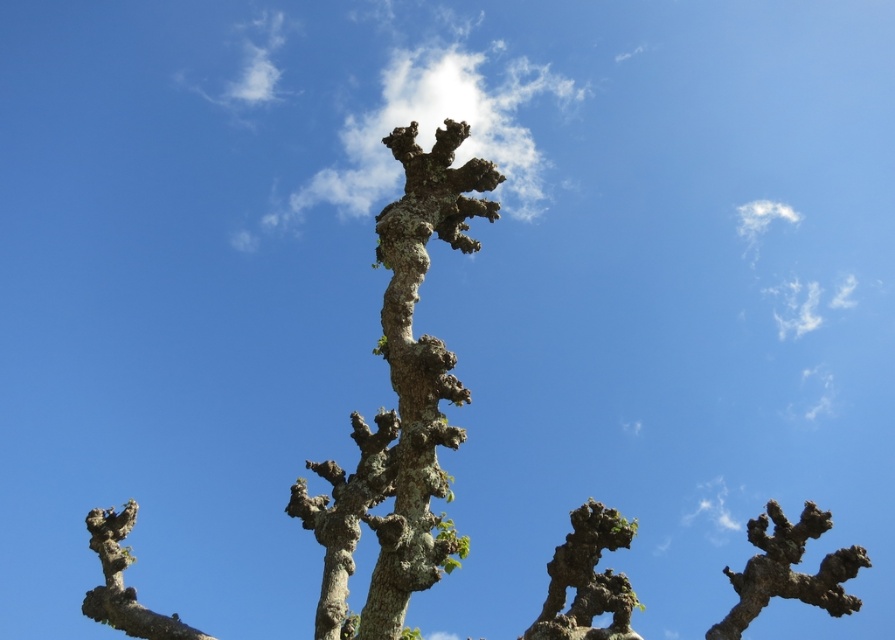
Which is above, green mossy tree trunk at center or lichen-covered bark tree at center?

green mossy tree trunk at center is above.

Which is more to the right, green mossy tree trunk at center or lichen-covered bark tree at center?

Positioned to the right is green mossy tree trunk at center.

Is point (629, 596) positioned behind point (386, 221)?

Yes, it is.

You are a GUI agent. You are given a task and a screenshot of the screen. Output one action in this format:
    pyautogui.click(x=<x>, y=<y>)
    Task: Click on the green mossy tree trunk at center
    The image size is (895, 640).
    Given the screenshot: What is the action you would take?
    pyautogui.click(x=401, y=406)

Does green mossy tree trunk at center have a lesser height compared to barky brown branch at center?

Indeed, green mossy tree trunk at center has a lesser height compared to barky brown branch at center.

Which is behind, point (403, 552) or point (838, 612)?

Point (838, 612)

Find the location of a particular element. green mossy tree trunk at center is located at coordinates (401, 406).

Is point (343, 596) farther from viewer compared to point (705, 634)?

No.

Which is above, lichen-covered bark tree at center or barky brown branch at center?

Positioned higher is lichen-covered bark tree at center.

Is point (407, 372) farther from viewer compared to point (771, 515)?

No, (407, 372) is in front of (771, 515).

You are a GUI agent. You are given a task and a screenshot of the screen. Output one action in this format:
    pyautogui.click(x=<x>, y=<y>)
    Task: Click on the lichen-covered bark tree at center
    
    Given the screenshot: What is the action you would take?
    pyautogui.click(x=399, y=404)